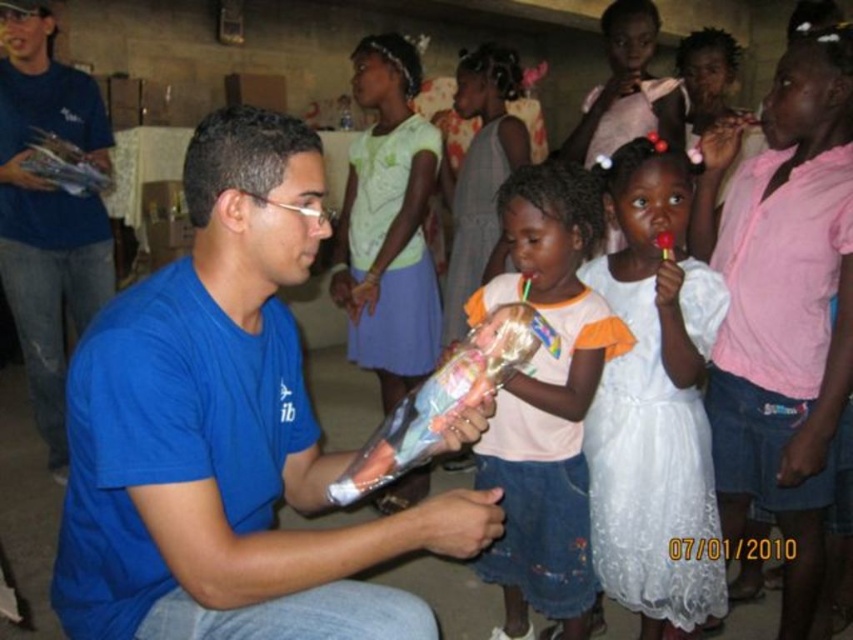
Which is in front, point (706, 602) or point (26, 13)?

Point (706, 602)

At what (x,y) coordinates should I click in order to perform the action: click on white lace dress at center. Please return your answer as a coordinate pair (x, y). Looking at the image, I should click on (654, 403).

Image resolution: width=853 pixels, height=640 pixels. What are the coordinates of `white lace dress at center` in the screenshot? It's located at (654, 403).

Between blue cotton shirt at center and pink cotton dress at center, which one has more height?

pink cotton dress at center is taller.

Is blue cotton shirt at center in front of pink cotton dress at center?

Yes, blue cotton shirt at center is in front of pink cotton dress at center.

This screenshot has width=853, height=640. Find the location of `blue cotton shirt at center`. blue cotton shirt at center is located at coordinates (227, 432).

Does point (164, 397) lie in front of point (42, 353)?

That is True.

Is point (247, 564) behind point (80, 104)?

No, it is in front of (80, 104).

Does point (248, 120) come behind point (82, 330)?

No, it is in front of (82, 330).

Locate an element on the screen. blue cotton shirt at center is located at coordinates (227, 432).